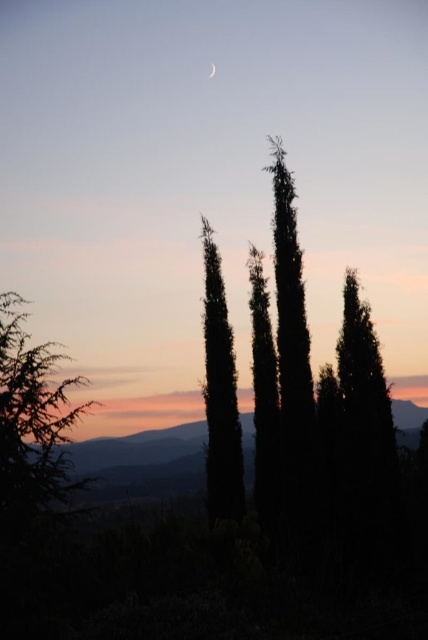
Does green leafy tree at left appear under silhouette coniferous tree at center?

Yes, green leafy tree at left is below silhouette coniferous tree at center.

Is point (27, 353) behind point (219, 308)?

No, it is in front of (219, 308).

Locate an element on the screen. green leafy tree at left is located at coordinates (32, 419).

Is green leafy tree at left above silvery reflective crescent at upper center?

No, green leafy tree at left is not above silvery reflective crescent at upper center.

Does green leafy tree at left come behind silvery reflective crescent at upper center?

No, it is not.

Which is behind, point (50, 436) or point (213, 65)?

The point (213, 65) is behind.

The image size is (428, 640). Find the location of `green leafy tree at left`. green leafy tree at left is located at coordinates [32, 419].

Which of these two, silhouette coniferous tree at center or silvery reflective crescent at upper center, stands shorter?

With less height is silvery reflective crescent at upper center.

Who is more distant from viewer, (213,250) or (213,65)?

Point (213,65)

Image resolution: width=428 pixels, height=640 pixels. In order to click on silhouette coniferous tree at center in this screenshot , I will do `click(219, 396)`.